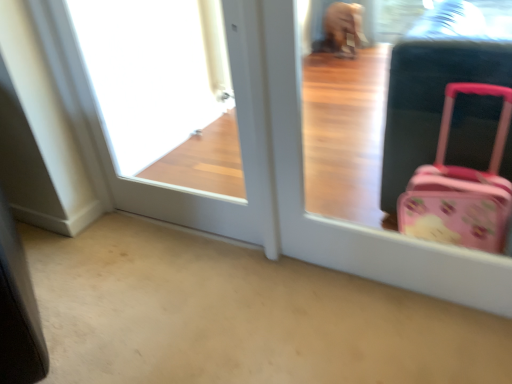
At what (x,y) coordinates should I click in order to perform the action: click on free space to the left of pink plastic suitcase at right. Please return your answer as a coordinate pair (x, y). This screenshot has width=512, height=384. Looking at the image, I should click on (279, 306).